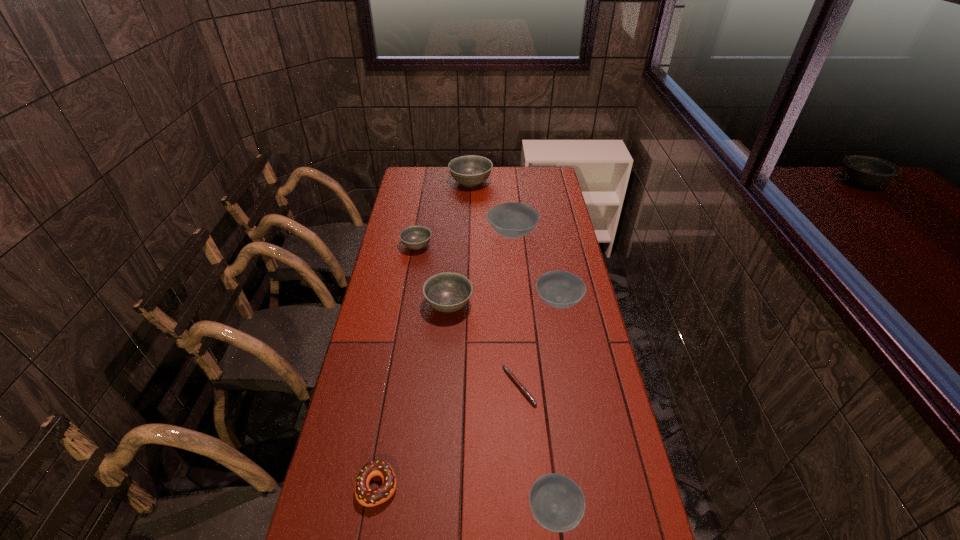
Where is `empty space between the pink pen and the biggest gray bowl`? empty space between the pink pen and the biggest gray bowl is located at coordinates (494, 285).

This screenshot has height=540, width=960. Identify the location of free area in between the farthest gray bowl and the seventh tallest object. (424, 334).

Locate an element on the screen. object that is the sixth closest one to the smallest brown bowl is located at coordinates (414, 237).

Identify which object is the closest to the third nearest object. Please provide its 2D coordinates. Your answer should be formatted as a tuple, i.e. [(x, y)], where the tuple contains the x and y coordinates of a point satisfying the conditions above.

[(560, 289)]

Locate an element on the screen. The height and width of the screenshot is (540, 960). bowl that stands as the fourth closest to the third nearest object is located at coordinates (513, 220).

Identify the location of bowl identified as the second closest to the pen. Image resolution: width=960 pixels, height=540 pixels. (447, 292).

Find the location of a particular element. This screenshot has width=960, height=540. the second closest gray bowl to the smallest gray bowl is located at coordinates (471, 170).

Identify the location of the closest gray bowl relative to the doughnut. (447, 292).

Identify which brown bowl is the second closest to the second smallest gray bowl. Please provide its 2D coordinates. Your answer should be formatted as a tuple, i.e. [(x, y)], where the tuple contains the x and y coordinates of a point satisfying the conditions above.

[(513, 220)]

This screenshot has height=540, width=960. In order to click on brown bowl object that ranks as the second closest to the farthest brown bowl in this screenshot , I will do `click(557, 503)`.